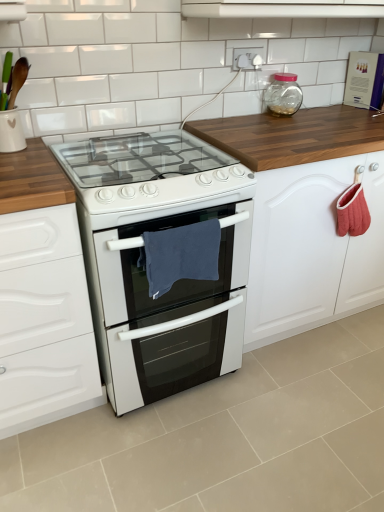
What is the approximate height of white glossy tile at upper center?

18.51 inches.

What do you see at coordinates (165, 62) in the screenshot? I see `white glossy tile at upper center` at bounding box center [165, 62].

Identify the location of transparent glass jar at upper right. (283, 94).

In the scene shown: In order to face blue fabric towel at center, should I rotate leftwards or rightwards?

Rotate left and turn 1.425 degrees.

The width and height of the screenshot is (384, 512). Find the location of `white glossy vent at upper center`. white glossy vent at upper center is located at coordinates (283, 8).

Is white glossy tile at upper center facing towards blue fabric towel at center?

No, white glossy tile at upper center is not aimed at blue fabric towel at center.

Considering the sizes of white glossy tile at upper center and blue fabric towel at center in the image, is white glossy tile at upper center bigger or smaller than blue fabric towel at center?

Clearly, white glossy tile at upper center is larger in size than blue fabric towel at center.

Does white glossy tile at upper center appear on the left side of blue fabric towel at center?

In fact, white glossy tile at upper center is to the right of blue fabric towel at center.

Could you tell me if white glossy oven at center is facing transparent glass jar at upper right?

No, white glossy oven at center is not turned towards transparent glass jar at upper right.

Is white glossy oven at center bigger or smaller than transparent glass jar at upper right?

white glossy oven at center is bigger than transparent glass jar at upper right.

Considering the relative positions of white glossy oven at center and transparent glass jar at upper right in the image provided, is white glossy oven at center behind transparent glass jar at upper right?

No, the depth of white glossy oven at center is less than that of transparent glass jar at upper right.

Which point is more distant from viewer, (231,319) or (273,90)?

The point (273,90) is farther.

Between point (196, 251) and point (102, 259), which one is positioned in front?

The point (102, 259) is in front.

How many degrees apart are the facing directions of blue fabric towel at center and white glossy oven at center?

0.000898 degrees.

Is blue fabric towel at center turned away from white glossy oven at center?

Correct, blue fabric towel at center is looking away from white glossy oven at center.

Can white glossy oven at center be found inside blue fabric towel at center?

No.

In terms of width, does transparent glass jar at upper right look wider or thinner when compared to white glossy tile at upper center?

In the image, transparent glass jar at upper right appears to be wider than white glossy tile at upper center.

Measure the distance from transparent glass jar at upper right to white glossy tile at upper center.

The distance of transparent glass jar at upper right from white glossy tile at upper center is 41.01 centimeters.

Does transparent glass jar at upper right come behind white glossy tile at upper center?

Yes, transparent glass jar at upper right is further from the camera.

Could you tell me if transparent glass jar at upper right is turned towards white glossy tile at upper center?

No.

Considering their positions, is white glossy oven at center located in front of or behind blue fabric towel at center?

In the image, white glossy oven at center appears in front of blue fabric towel at center.

Is white glossy oven at center touching blue fabric towel at center?

No, white glossy oven at center is not next to blue fabric towel at center.

Is white glossy tile at upper center far from white glossy oven at center?

No, there isn't a large distance between white glossy tile at upper center and white glossy oven at center.

Is white glossy oven at center completely or partially inside white glossy tile at upper center?

No, white glossy tile at upper center does not contain white glossy oven at center.

Which object is closer to the camera taking this photo, white glossy tile at upper center or white glossy oven at center?

white glossy oven at center is in front.

Is point (64, 34) closer or farther from the camera than point (377, 5)?

Point (64, 34) appears to be closer to the viewer than point (377, 5).

Is white glossy tile at upper center looking in the opposite direction of white glossy vent at upper center?

That's right, white glossy tile at upper center is facing away from white glossy vent at upper center.

Is white glossy tile at upper center positioned before white glossy vent at upper center?

No, it is not.

How different are the orientations of white glossy tile at upper center and white glossy vent at upper center in degrees?

The facing directions of white glossy tile at upper center and white glossy vent at upper center are 0.194 degrees apart.

You are a GUI agent. You are given a task and a screenshot of the screen. Output one action in this format:
    pyautogui.click(x=<x>, y=<y>)
    Task: Click on the tile above the blue fabric towel at center (from the image's perspective)
    
    Given the screenshot: What is the action you would take?
    pyautogui.click(x=165, y=62)

There is a white glossy oven at center. Where is `bottle above it (from a real-world perspective)`? bottle above it (from a real-world perspective) is located at coordinates (283, 94).

Looking at the image, which one is located closer to white glossy vent at upper center, white glossy oven at center or white glossy tile at upper center?

white glossy tile at upper center is closer to white glossy vent at upper center.

Looking at the image, which one is located further to blue fabric towel at center, white glossy tile at upper center or white glossy vent at upper center?

The object further to blue fabric towel at center is white glossy vent at upper center.

Based on their spatial positions, is white glossy tile at upper center or transparent glass jar at upper right further from white glossy vent at upper center?

transparent glass jar at upper right is positioned further to the anchor white glossy vent at upper center.

Based on their spatial positions, is white glossy vent at upper center or white glossy oven at center closer to blue fabric towel at center?

white glossy oven at center is closer to blue fabric towel at center.

Considering their positions, is white glossy tile at upper center positioned further to white glossy oven at center than blue fabric towel at center?

white glossy tile at upper center is positioned further to the anchor white glossy oven at center.

From the image, which object appears to be nearer to blue fabric towel at center, white glossy oven at center or white glossy tile at upper center?

white glossy oven at center.

Based on their spatial positions, is transparent glass jar at upper right or white glossy vent at upper center closer to white glossy oven at center?

transparent glass jar at upper right lies closer to white glossy oven at center than the other object.

Which object lies further to the anchor point blue fabric towel at center, white glossy oven at center or white glossy vent at upper center?

Among the two, white glossy vent at upper center is located further to blue fabric towel at center.

Where is `bottle between white glossy vent at upper center and blue fabric towel at center in the vertical direction`? The width and height of the screenshot is (384, 512). bottle between white glossy vent at upper center and blue fabric towel at center in the vertical direction is located at coordinates (283, 94).

Find the location of a particular element. bottle that lies between white glossy vent at upper center and white glossy oven at center from top to bottom is located at coordinates (283, 94).

You are a GUI agent. You are given a task and a screenshot of the screen. Output one action in this format:
    pyautogui.click(x=<x>, y=<y>)
    Task: Click on the tile that lies between white glossy vent at upper center and white glossy oven at center from top to bottom
    
    Given the screenshot: What is the action you would take?
    pyautogui.click(x=165, y=62)

Where is `tile between white glossy vent at upper center and transparent glass jar at upper right in the front-back direction`? This screenshot has height=512, width=384. tile between white glossy vent at upper center and transparent glass jar at upper right in the front-back direction is located at coordinates (165, 62).